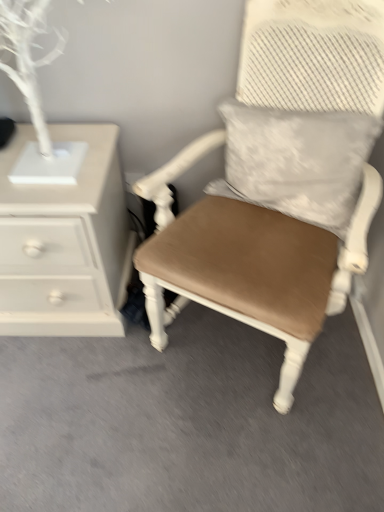
At what (x,y) coordinates should I click in order to perform the action: click on free space that is to the left of matte brown cushioned chair at center. Please return your answer as a coordinate pair (x, y). The width and height of the screenshot is (384, 512). Looking at the image, I should click on (89, 394).